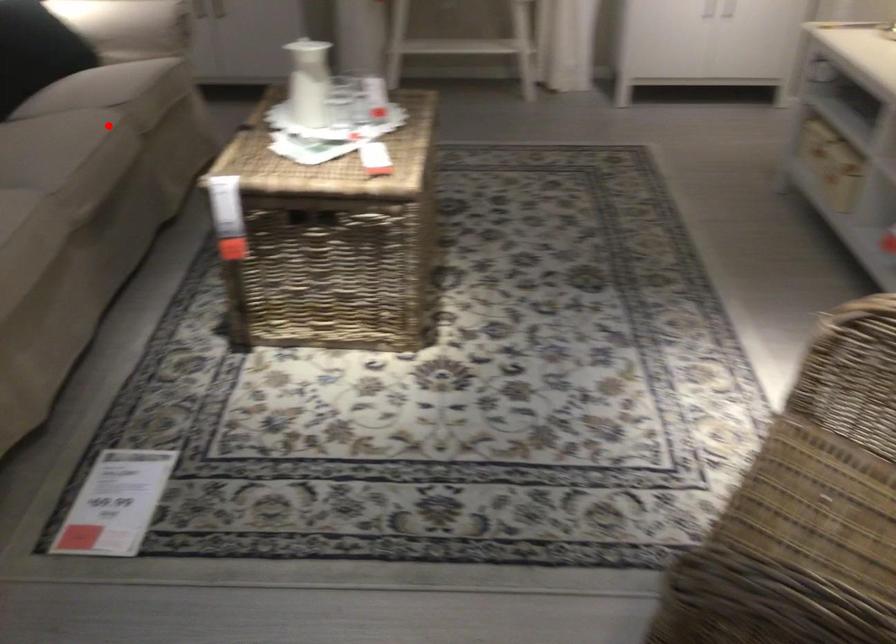
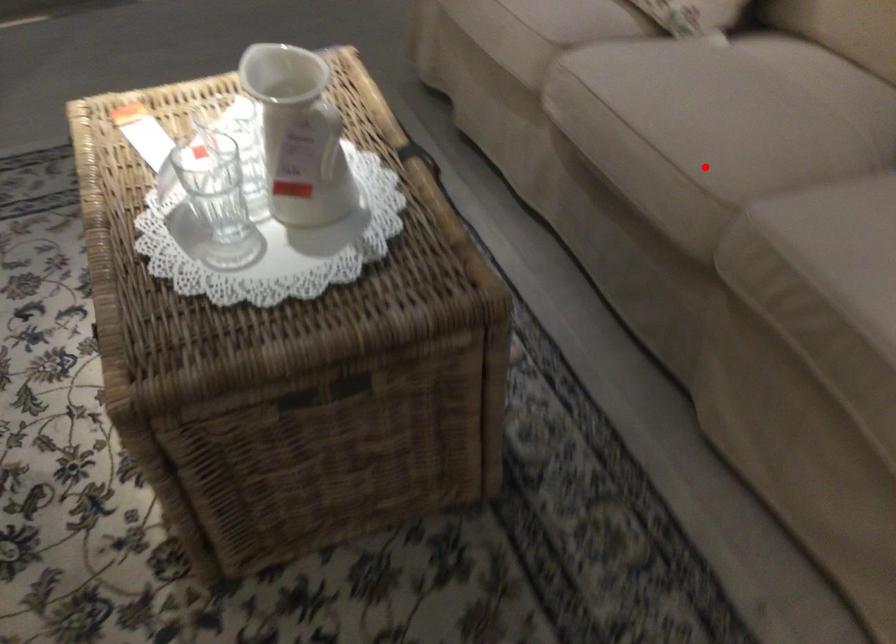
I am providing you with two images of the same scene from different viewpoints. A red point is marked on the first image and another point is marked on the second image. Is the red point in image1 aligned with the point shown in image2?

Yes